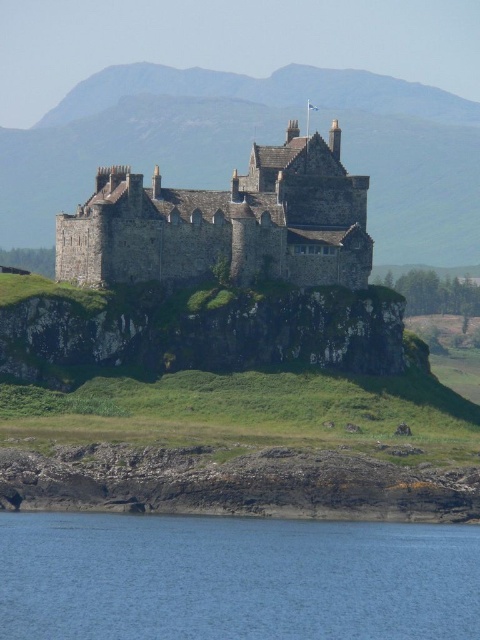
Is point (58, 106) behind point (294, 243)?

Yes.

Can you confirm if brown stone castle at center is positioned to the right of stone medieval castle at center?

Indeed, brown stone castle at center is positioned on the right side of stone medieval castle at center.

Which is behind, point (381, 170) or point (357, 268)?

Positioned behind is point (381, 170).

The image size is (480, 640). In order to click on brown stone castle at center in this screenshot , I will do `click(250, 147)`.

Does blue water at lower left lie in front of brown stone castle at center?

Yes, blue water at lower left is closer to the viewer.

Is blue water at lower left below brown stone castle at center?

Yes, blue water at lower left is below brown stone castle at center.

Is point (291, 616) farther from camera compared to point (214, 144)?

No.

Find the location of a particular element. The height and width of the screenshot is (640, 480). blue water at lower left is located at coordinates (235, 579).

Is point (6, 611) farther from camera compared to point (271, 221)?

No, it is not.

Is blue water at lower left shorter than stone medieval castle at center?

Indeed, blue water at lower left has a lesser height compared to stone medieval castle at center.

Is point (132, 630) closer to viewer compared to point (120, 237)?

Yes, point (132, 630) is closer to viewer.

Where is `blue water at lower left`? The width and height of the screenshot is (480, 640). blue water at lower left is located at coordinates (235, 579).